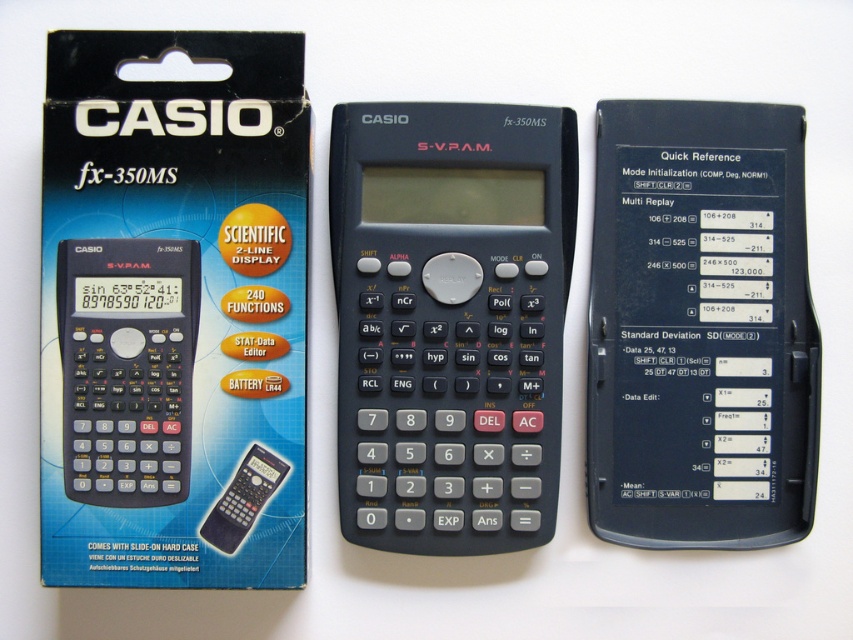
Can you confirm if black plastic calculator at center is positioned below matte black calculator at center?

No, black plastic calculator at center is not below matte black calculator at center.

Does black plastic calculator at center appear on the left side of matte black calculator at center?

Incorrect, black plastic calculator at center is not on the left side of matte black calculator at center.

Identify the location of black plastic calculator at center. (450, 321).

Find the location of a particular element. black plastic calculator at center is located at coordinates (450, 321).

Who is taller, matte black calculator at center or black matte calculator at center?

Standing taller between the two is matte black calculator at center.

Is the position of matte black calculator at center more distant than that of black matte calculator at center?

That is False.

Does point (80, 308) lie in front of point (250, 515)?

Yes, point (80, 308) is closer to viewer.

You are a GUI agent. You are given a task and a screenshot of the screen. Output one action in this format:
    pyautogui.click(x=<x>, y=<y>)
    Task: Click on the matte black calculator at center
    
    Given the screenshot: What is the action you would take?
    pyautogui.click(x=126, y=368)

Locate an element on the screen. black plastic calculator at center is located at coordinates (450, 321).

Between point (335, 205) and point (256, 465), which one is positioned behind?

The point (335, 205) is behind.

Measure the distance between black plastic calculator at center and camera.

black plastic calculator at center and camera are 37.48 inches apart from each other.

At what (x,y) coordinates should I click in order to perform the action: click on black plastic calculator at center. Please return your answer as a coordinate pair (x, y). The width and height of the screenshot is (853, 640). Looking at the image, I should click on [450, 321].